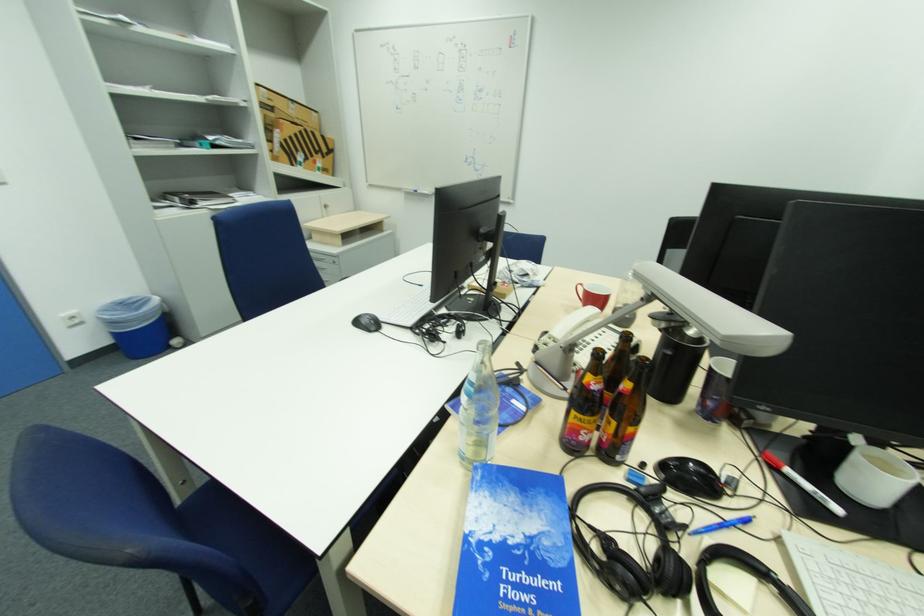
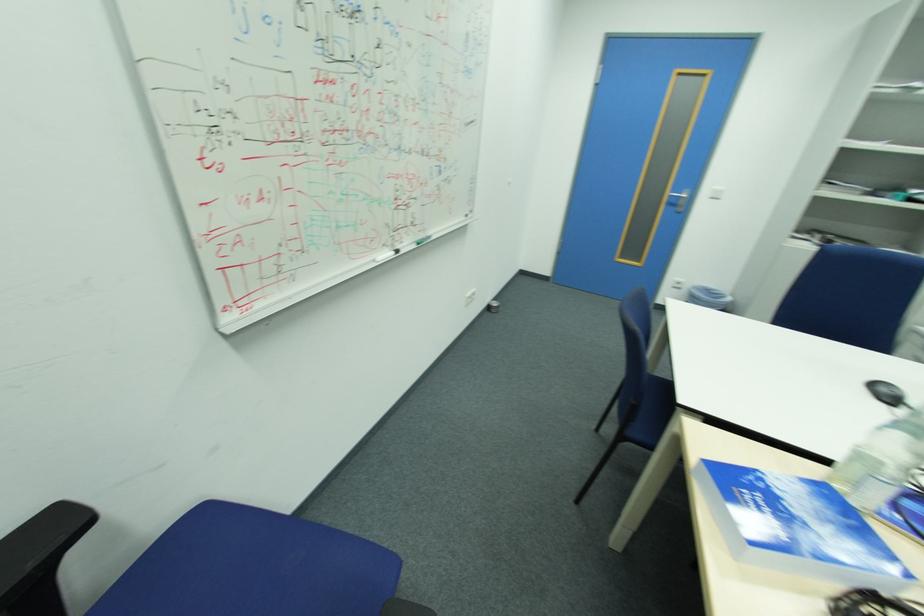
Locate, in the second image, the point that corresponds to point 525,541 in the first image.

(796, 512)